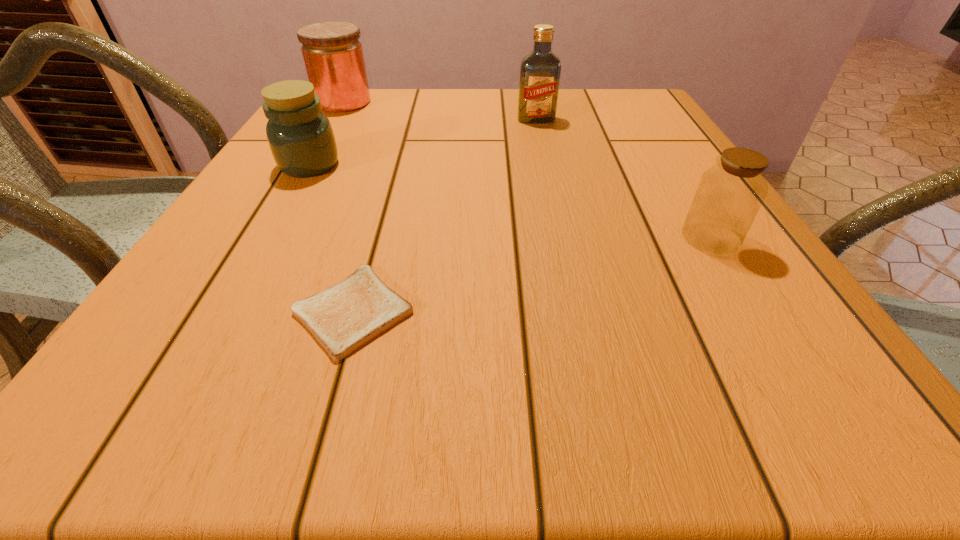
Identify the location of vacant point located 0.050m on the right of the third farthest object. This screenshot has height=540, width=960. (364, 165).

Where is `vacant space situated 0.290m on the back of the second nearest object`? Image resolution: width=960 pixels, height=540 pixels. vacant space situated 0.290m on the back of the second nearest object is located at coordinates (653, 144).

The height and width of the screenshot is (540, 960). I want to click on free space located on the right of the toast, so click(x=449, y=311).

The width and height of the screenshot is (960, 540). What are the coordinates of `vodka that is at the far edge` in the screenshot? It's located at (540, 70).

Locate an element on the screen. The width and height of the screenshot is (960, 540). jar that is at the far edge is located at coordinates (333, 56).

This screenshot has width=960, height=540. I want to click on object that is at the near edge, so click(347, 315).

The width and height of the screenshot is (960, 540). Identify the location of object located at the right edge. (730, 193).

Identify the location of object present at the far left corner. (x=333, y=56).

What are the coordinates of `vacant space at the far edge of the desktop` in the screenshot? It's located at (503, 93).

Locate an element on the screen. This screenshot has height=540, width=960. free space at the near edge of the desktop is located at coordinates (401, 369).